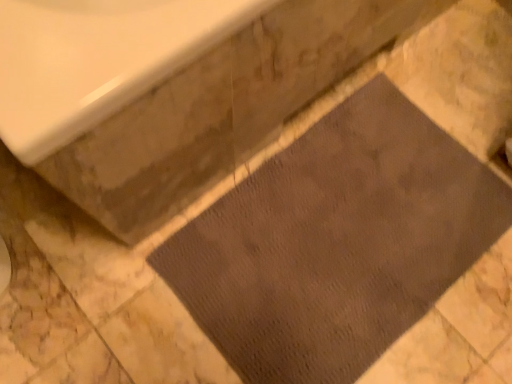
Question: Does brown textured mat at lower right appear on the right side of brown textured mat at center?

Choices:
 (A) no
 (B) yes

Answer: (A)

Question: Could you tell me if brown textured mat at lower right is turned towards brown textured mat at center?

Choices:
 (A) no
 (B) yes

Answer: (B)

Question: Considering the relative sizes of brown textured mat at lower right and brown textured mat at center in the image provided, is brown textured mat at lower right wider than brown textured mat at center?

Choices:
 (A) no
 (B) yes

Answer: (B)

Question: Is brown textured mat at lower right facing away from brown textured mat at center?

Choices:
 (A) no
 (B) yes

Answer: (A)

Question: Is brown textured mat at lower right beside brown textured mat at center?

Choices:
 (A) yes
 (B) no

Answer: (B)

Question: From a real-world perspective, is brown textured mat at lower right under brown textured mat at center?

Choices:
 (A) yes
 (B) no

Answer: (B)

Question: Does brown textured mat at center have a larger size compared to brown textured mat at lower right?

Choices:
 (A) yes
 (B) no

Answer: (B)

Question: Considering the relative sizes of brown textured mat at center and brown textured mat at lower right in the image provided, is brown textured mat at center shorter than brown textured mat at lower right?

Choices:
 (A) no
 (B) yes

Answer: (B)

Question: From the image's perspective, does brown textured mat at center appear lower than brown textured mat at lower right?

Choices:
 (A) no
 (B) yes

Answer: (B)

Question: Considering the relative positions of brown textured mat at center and brown textured mat at lower right in the image provided, is brown textured mat at center to the left of brown textured mat at lower right from the viewer's perspective?

Choices:
 (A) yes
 (B) no

Answer: (B)

Question: From the image's perspective, is brown textured mat at center above brown textured mat at lower right?

Choices:
 (A) no
 (B) yes

Answer: (A)

Question: Does brown textured mat at center have a lesser width compared to brown textured mat at lower right?

Choices:
 (A) no
 (B) yes

Answer: (B)

Question: Based on their sizes in the image, would you say brown textured mat at lower right is bigger or smaller than brown textured mat at center?

Choices:
 (A) small
 (B) big

Answer: (B)